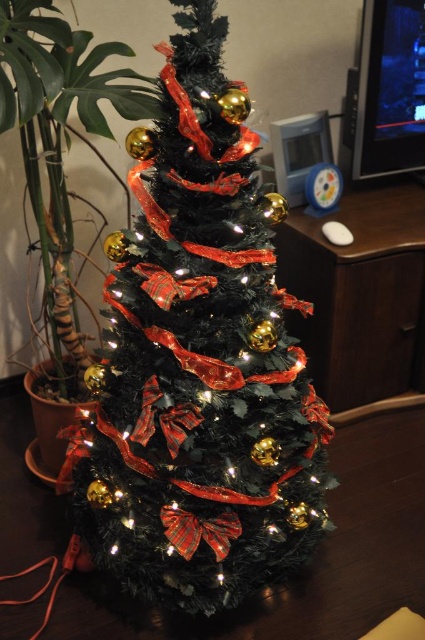
You are planning to place a new decoration on the shiny green christmas tree at center. However, you need to ensure it won not block the view of the brown wood table at right. Given their sizes, is this possible?

The shiny green christmas tree at center is larger in size than the brown wood table at right, so it is possible to place the decoration without blocking the view of the brown wood table at right by positioning it towards the front or sides of the tree.

You are standing in front of the Christmas tree and want to place a new ornament exactly at the point labeled point (198,362). Based on the scene description, where on the Christmas tree should you place the ornament?

The point (198,362) corresponds to the shiny green Christmas tree at center, so you should place the ornament at the center of the Christmas tree.